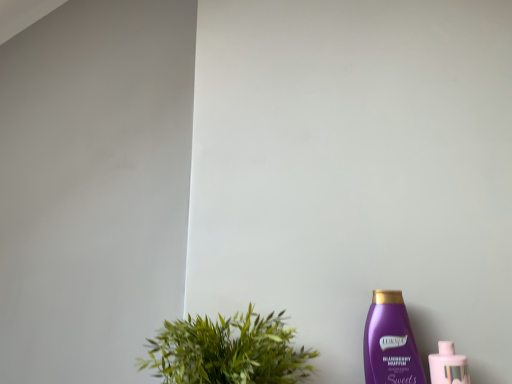
Question: From a real-world perspective, is green leafy plant at lower left positioned above or below pink glossy bottle at lower right, which is the second bottle from left to right?

Choices:
 (A) below
 (B) above

Answer: (B)

Question: From the image's perspective, is green leafy plant at lower left above or below pink glossy bottle at lower right, which is the second bottle from left to right?

Choices:
 (A) above
 (B) below

Answer: (A)

Question: Which object is the closest to the pink glossy bottle at lower right, arranged as the first bottle when viewed from the right?

Choices:
 (A) purple plastic bottle at lower right, marked as the second bottle in a right-to-left arrangement
 (B) green leafy plant at lower left

Answer: (A)

Question: Which of these objects is positioned closest to the purple plastic bottle at lower right, marked as the second bottle in a right-to-left arrangement?

Choices:
 (A) pink glossy bottle at lower right, arranged as the first bottle when viewed from the right
 (B) green leafy plant at lower left

Answer: (A)